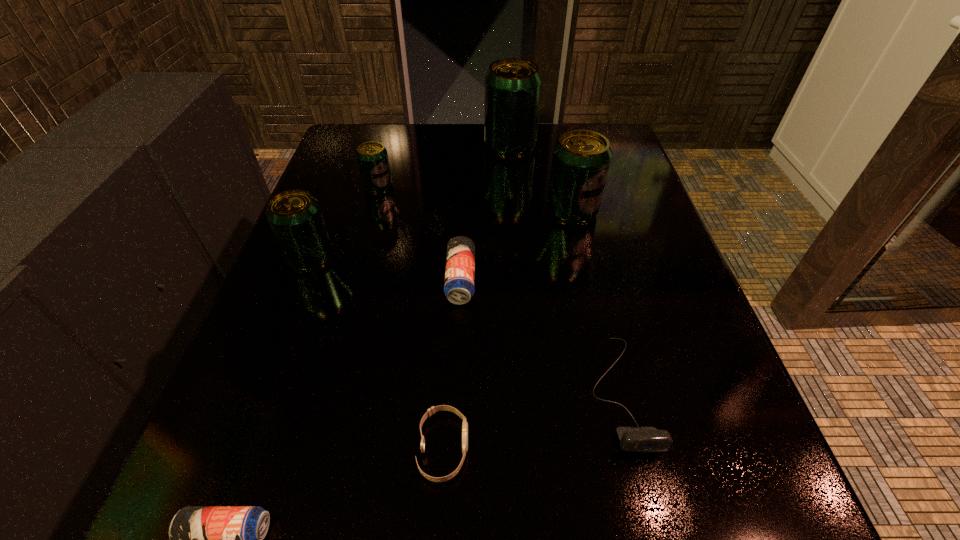
In order to click on green beer can object that ranks as the second closest to the tallest beer can in this screenshot , I will do `click(372, 157)`.

Where is `vacant space that satisfies the following two spatial constraints: 1. on the back side of the fifth nearest beer can; 2. on the left side of the biggest green beer can`? vacant space that satisfies the following two spatial constraints: 1. on the back side of the fifth nearest beer can; 2. on the left side of the biggest green beer can is located at coordinates (390, 147).

Find the location of a particular element. vacant position in the image that satisfies the following two spatial constraints: 1. on the front side of the fifth shortest beer can; 2. on the right side of the farthest object is located at coordinates (516, 212).

Where is `vacant position in the image that satisfies the following two spatial constraints: 1. on the front side of the second tallest object; 2. on the right side of the tallest beer can`? The image size is (960, 540). vacant position in the image that satisfies the following two spatial constraints: 1. on the front side of the second tallest object; 2. on the right side of the tallest beer can is located at coordinates (516, 212).